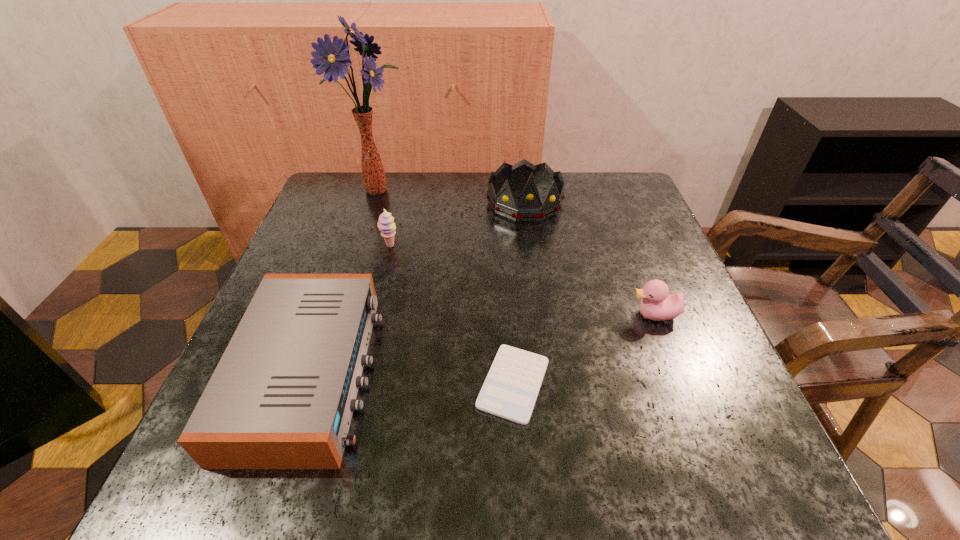
At what (x,y) coordinates should I click in order to perform the action: click on flower arrangement. Please return your answer as a coordinate pair (x, y). The width and height of the screenshot is (960, 540). Looking at the image, I should click on (332, 58).

Locate an element on the screen. Image resolution: width=960 pixels, height=540 pixels. tiara is located at coordinates (529, 208).

Find the location of `sherbert`. sherbert is located at coordinates (386, 225).

This screenshot has width=960, height=540. I want to click on the third tallest object, so click(x=386, y=225).

The image size is (960, 540). I want to click on duckling, so click(x=657, y=304).

At what (x,y) coordinates should I click in order to perform the action: click on radio receiver. Please return your answer as a coordinate pair (x, y). The width and height of the screenshot is (960, 540). Looking at the image, I should click on (282, 396).

Identify the location of the shortest object. (510, 390).

Identify the location of vacant space located on the right of the flower arrangement. Image resolution: width=960 pixels, height=540 pixels. (505, 189).

Where is `blank space located at the front of the fifth shortest object with jewels`? blank space located at the front of the fifth shortest object with jewels is located at coordinates (531, 246).

This screenshot has height=540, width=960. I want to click on vacant region located on the front of the fourth shortest object, so 369,336.